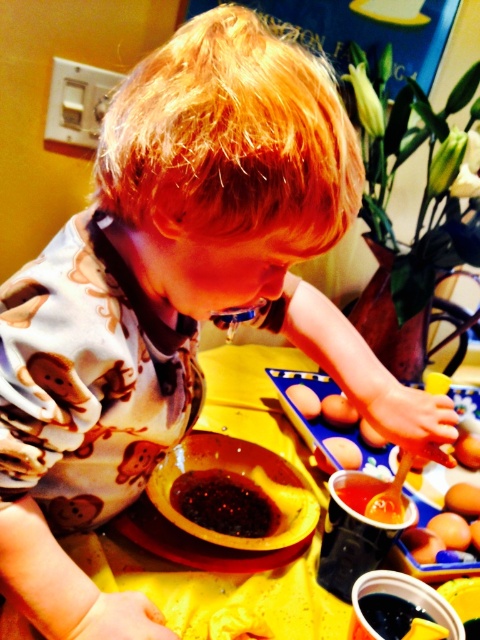
Which of these two, yellow matte table at center or dark glossy sauce at center, stands taller?

Standing taller between the two is yellow matte table at center.

Is yellow matte table at center below dark glossy sauce at center?

No.

Does point (239, 420) lie in front of point (231, 486)?

No, (239, 420) is further to viewer.

Find the location of `yellow matte table at center`. yellow matte table at center is located at coordinates (217, 572).

Who is taller, dark glossy sauce at center or brown matte egg at center?

With more height is dark glossy sauce at center.

Is point (227, 529) closer to camera compared to point (304, 396)?

Yes.

Between point (248, 522) and point (313, 416), which one is positioned behind?

Positioned behind is point (313, 416).

Identify the location of dark glossy sauce at center. (224, 502).

What do you see at coordinates (217, 572) in the screenshot?
I see `yellow matte table at center` at bounding box center [217, 572].

Is point (301, 614) farther from viewer compared to point (469, 454)?

No.

Between point (308, 560) and point (468, 444), which one is positioned in front?

Point (308, 560) is in front.

Locate an element on the screen. This screenshot has height=640, width=480. yellow matte table at center is located at coordinates (217, 572).